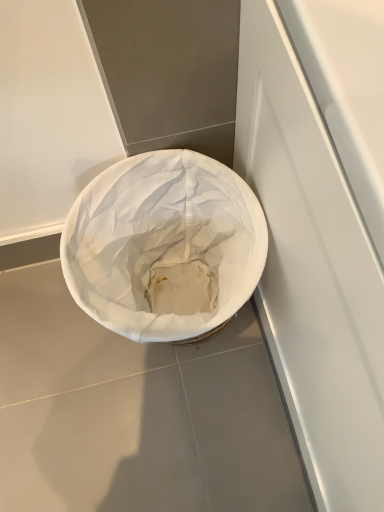
Find the location of a particular element. The height and width of the screenshot is (512, 384). white fabric basket at center is located at coordinates (163, 244).

Describe the element at coordinates (163, 244) in the screenshot. I see `white fabric basket at center` at that location.

This screenshot has width=384, height=512. I want to click on white fabric basket at center, so click(x=163, y=244).